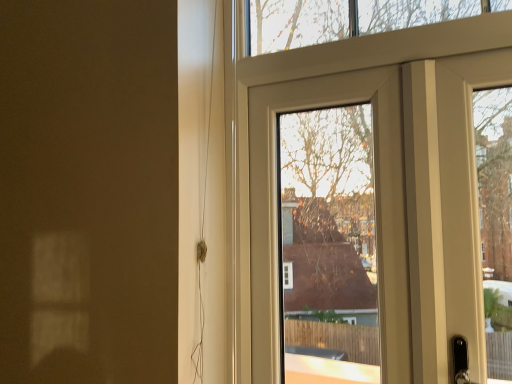
Image resolution: width=512 pixels, height=384 pixels. What do you see at coordinates (380, 185) in the screenshot?
I see `matte white door at upper right, the second door viewed from the left` at bounding box center [380, 185].

I want to click on matte white door at upper right, which ranks as the first door in right-to-left order, so click(x=380, y=185).

Identify the location of matte white door at center, acting as the first door starting from the left. (376, 209).

This screenshot has width=512, height=384. What do you see at coordinates (376, 209) in the screenshot?
I see `matte white door at center, acting as the first door starting from the left` at bounding box center [376, 209].

This screenshot has height=384, width=512. Find the location of `matte white door at upper right, which ranks as the first door in right-to-left order`. matte white door at upper right, which ranks as the first door in right-to-left order is located at coordinates (380, 185).

Which object is positioned more to the right, matte white door at upper right, which ranks as the first door in right-to-left order, or matte white door at center, acting as the first door starting from the left?

matte white door at upper right, which ranks as the first door in right-to-left order, is more to the right.

Which object is closer to the camera taking this photo, matte white door at upper right, the second door viewed from the left, or matte white door at center, which is counted as the 2th door, starting from the right?

matte white door at upper right, the second door viewed from the left, is in front.

Is point (441, 88) closer or farther from the camera than point (392, 179)?

Point (441, 88).

From the image's perspective, which is above, matte white door at upper right, the second door viewed from the left, or matte white door at center, which is counted as the 2th door, starting from the right?

matte white door at upper right, the second door viewed from the left.

From a real-world perspective, relative to matte white door at center, acting as the first door starting from the left, is matte white door at upper right, which ranks as the first door in right-to-left order, vertically above or below?

matte white door at upper right, which ranks as the first door in right-to-left order, is situated higher than matte white door at center, acting as the first door starting from the left, in the real world.

Which object is wider, matte white door at upper right, the second door viewed from the left, or matte white door at center, which is counted as the 2th door, starting from the right?

matte white door at upper right, the second door viewed from the left, is wider.

Is matte white door at upper right, which ranks as the first door in right-to-left order, taller than matte white door at center, which is counted as the 2th door, starting from the right?

Yes.

In the scene shown: Can you confirm if matte white door at upper right, which ranks as the first door in right-to-left order, is smaller than matte white door at center, which is counted as the 2th door, starting from the right?

Incorrect, matte white door at upper right, which ranks as the first door in right-to-left order, is not smaller in size than matte white door at center, which is counted as the 2th door, starting from the right.

Is matte white door at upper right, which ranks as the first door in right-to-left order, surrounding matte white door at center, acting as the first door starting from the left?

Yes, matte white door at center, acting as the first door starting from the left, is a part of matte white door at upper right, which ranks as the first door in right-to-left order.

Does matte white door at upper right, the second door viewed from the left, touch matte white door at center, acting as the first door starting from the left?

Yes, the surface of matte white door at upper right, the second door viewed from the left, is in contact with matte white door at center, acting as the first door starting from the left.

Is matte white door at upper right, which ranks as the first door in right-to-left order, oriented towards matte white door at center, which is counted as the 2th door, starting from the right?

Yes, matte white door at upper right, which ranks as the first door in right-to-left order, faces towards matte white door at center, which is counted as the 2th door, starting from the right.

How much distance is there between matte white door at upper right, the second door viewed from the left, and matte white door at center, acting as the first door starting from the left?

matte white door at upper right, the second door viewed from the left, is 1.36 inches from matte white door at center, acting as the first door starting from the left.

Where is `door beneath the matte white door at upper right, the second door viewed from the left (from a real-world perspective)`? The image size is (512, 384). door beneath the matte white door at upper right, the second door viewed from the left (from a real-world perspective) is located at coordinates (376, 209).

Which object is positioned more to the right, matte white door at center, acting as the first door starting from the left, or matte white door at upper right, which ranks as the first door in right-to-left order?

matte white door at upper right, which ranks as the first door in right-to-left order, is more to the right.

Is the depth of matte white door at center, acting as the first door starting from the left, less than that of matte white door at upper right, which ranks as the first door in right-to-left order?

No, the depth of matte white door at center, acting as the first door starting from the left, is greater than that of matte white door at upper right, which ranks as the first door in right-to-left order.

Does point (262, 160) lie in front of point (415, 341)?

No, (262, 160) is further to viewer.

From the image's perspective, which is above, matte white door at center, which is counted as the 2th door, starting from the right, or matte white door at upper right, the second door viewed from the left?

matte white door at upper right, the second door viewed from the left.

From a real-world perspective, which object rests below the other?

From a 3D spatial view, matte white door at center, which is counted as the 2th door, starting from the right, is below.

Looking at their sizes, would you say matte white door at center, acting as the first door starting from the left, is wider or thinner than matte white door at upper right, the second door viewed from the left?

matte white door at center, acting as the first door starting from the left, is thinner than matte white door at upper right, the second door viewed from the left.

Considering the sizes of objects matte white door at center, acting as the first door starting from the left, and matte white door at upper right, which ranks as the first door in right-to-left order, in the image provided, who is taller, matte white door at center, acting as the first door starting from the left, or matte white door at upper right, which ranks as the first door in right-to-left order,?

matte white door at upper right, which ranks as the first door in right-to-left order, is taller.

Can you confirm if matte white door at center, which is counted as the 2th door, starting from the right, is bigger than matte white door at upper right, which ranks as the first door in right-to-left order?

No.

Is matte white door at center, acting as the first door starting from the left, situated inside matte white door at upper right, the second door viewed from the left, or outside?

matte white door at center, acting as the first door starting from the left, is located inside matte white door at upper right, the second door viewed from the left.

Are matte white door at center, acting as the first door starting from the left, and matte white door at upper right, which ranks as the first door in right-to-left order, far apart?

matte white door at center, acting as the first door starting from the left, is actually quite close to matte white door at upper right, which ranks as the first door in right-to-left order.

Is matte white door at center, which is counted as the 2th door, starting from the right, oriented away from matte white door at upper right, the second door viewed from the left?

Yes, matte white door at center, which is counted as the 2th door, starting from the right,'s orientation is away from matte white door at upper right, the second door viewed from the left.

Measure the distance from matte white door at center, acting as the first door starting from the left, to matte white door at upper right, the second door viewed from the left.

They are 1.36 inches apart.

Identify the location of door above the matte white door at center, acting as the first door starting from the left (from a real-world perspective). This screenshot has width=512, height=384. (380, 185).

Find the location of `door on the left of matte white door at upper right, the second door viewed from the left`. door on the left of matte white door at upper right, the second door viewed from the left is located at coordinates (376, 209).

Find the location of `door below the matte white door at upper right, the second door viewed from the left (from a real-world perspective)`. door below the matte white door at upper right, the second door viewed from the left (from a real-world perspective) is located at coordinates (376, 209).